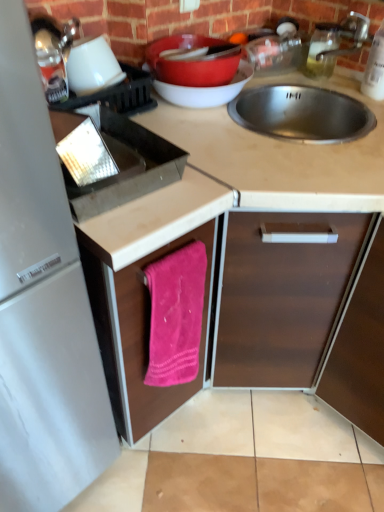
Find the location of a particular element. This screenshot has height=512, width=384. vacant space to the left of clear plastic bottle at upper right, arranged as the 1th bottle when viewed from the right is located at coordinates (336, 95).